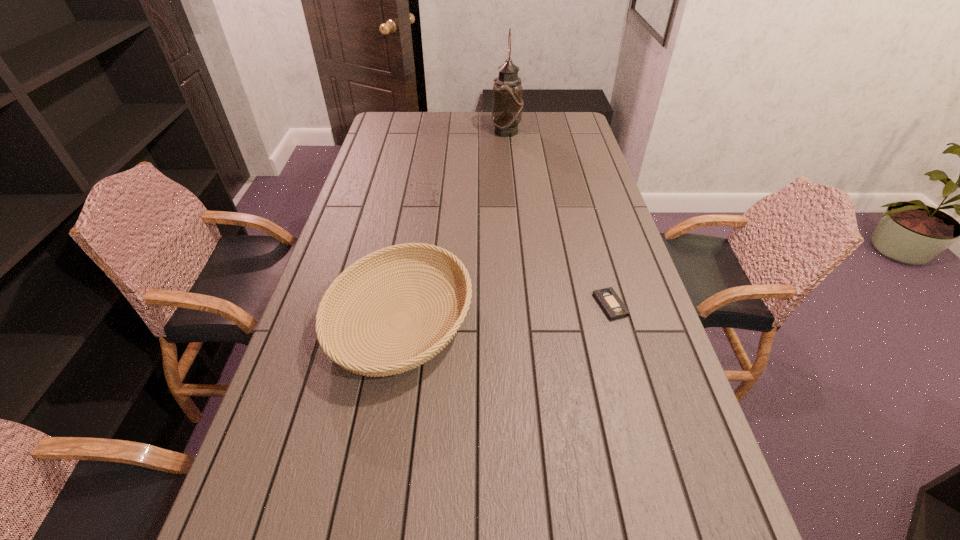
Locate an element on the screen. the tallest object is located at coordinates (x=507, y=103).

I want to click on the third object from left to right, so click(x=507, y=103).

The image size is (960, 540). Identify the location of basket. (326, 312).

Locate an element on the screen. This screenshot has height=540, width=960. the second shortest object is located at coordinates (436, 191).

You are a GUI agent. You are given a task and a screenshot of the screen. Output one action in this format:
    pyautogui.click(x=<x>, y=<y>)
    Task: Click on the third nearest object
    
    Given the screenshot: What is the action you would take?
    pyautogui.click(x=436, y=191)

This screenshot has width=960, height=540. Identify the location of the rightmost object. (607, 298).

Where is `videotape`? This screenshot has height=540, width=960. videotape is located at coordinates (607, 298).

Identify the location of vacant space located on the front of the oil lamp. (511, 180).

At what (x,y) coordinates should I click in order to perform the action: click on free space located on the back of the third shortest object. Please return your answer as a coordinate pair (x, y). The image size is (960, 540). Looking at the image, I should click on (412, 254).

This screenshot has width=960, height=540. Find the location of `vacant space located 0.350m on the temples of the second shortest object`. vacant space located 0.350m on the temples of the second shortest object is located at coordinates (537, 198).